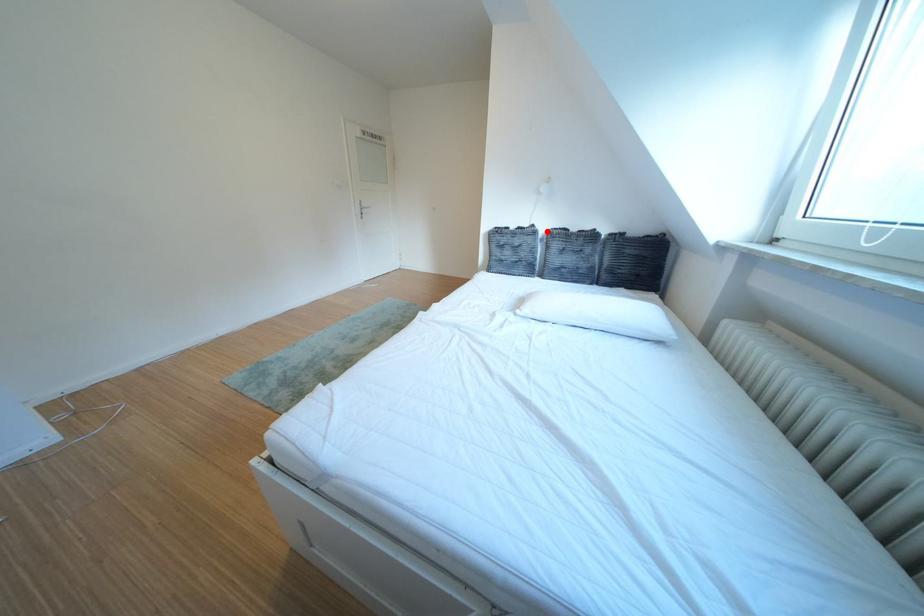
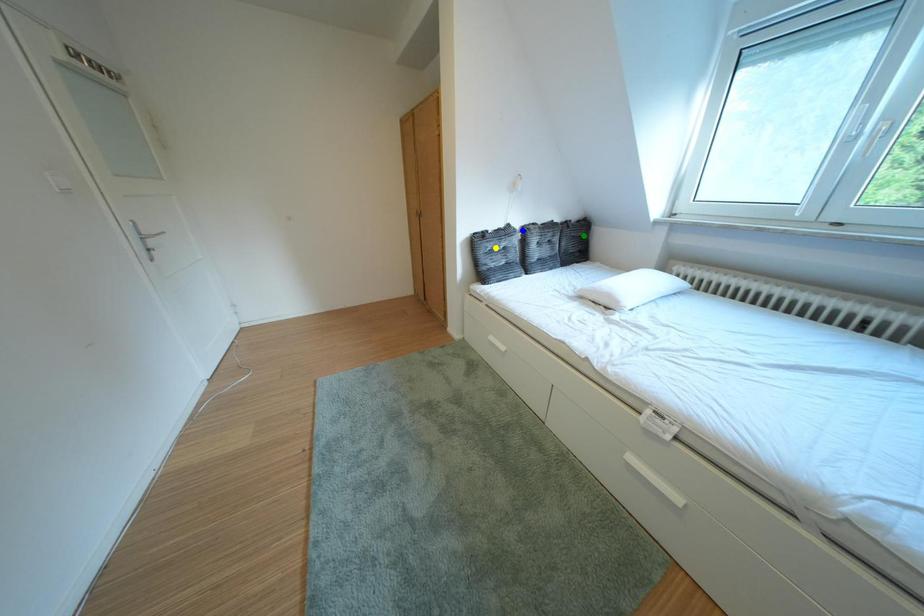
Question: I am providing you with two images of the same scene from different viewpoints. A red point is marked on the first image. You are given multiple points on the second image. In image 2, which mark is for the same physical point as the one in image 1?

Choices:
 (A) green point
 (B) blue point
 (C) yellow point

Answer: (B)